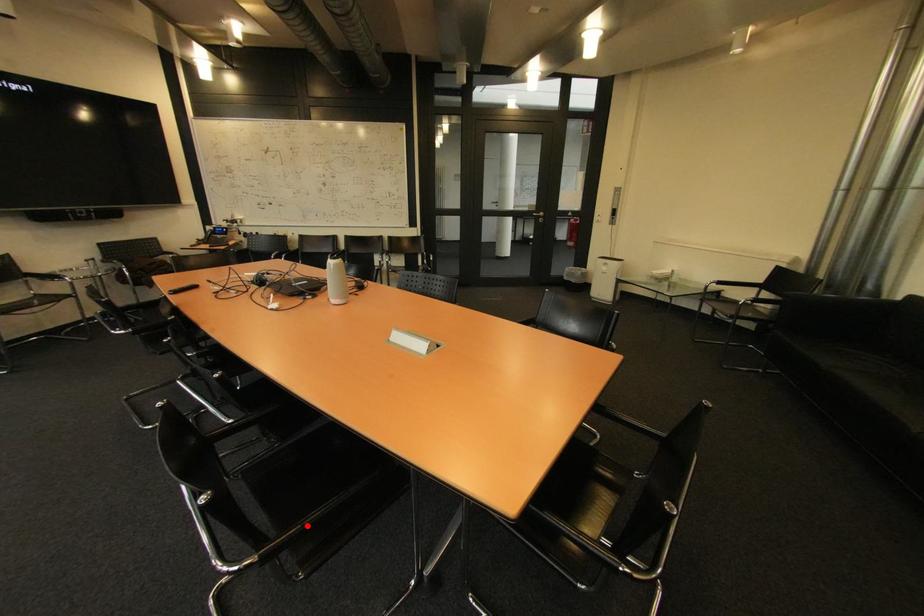
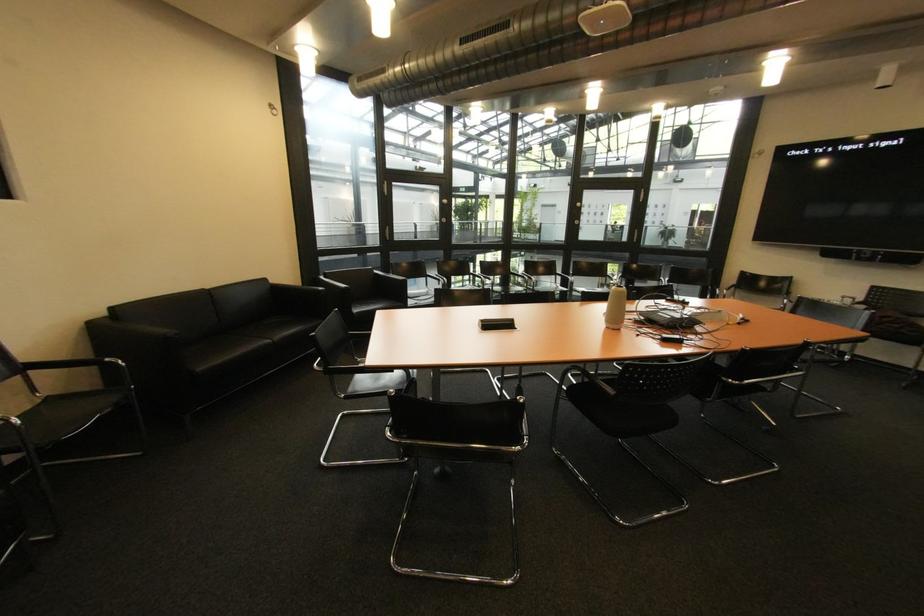
Question: I am providing you with two images of the same scene from different viewpoints. A red point is marked on the first image. At the location where the point appears in image 1, is it still visible in image 2?

Choices:
 (A) Yes
 (B) No

Answer: (B)